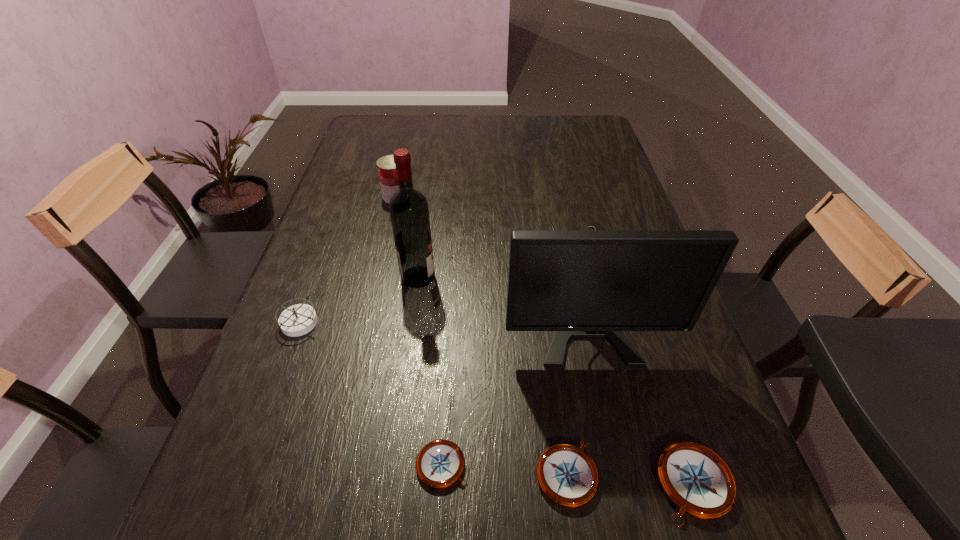
Locate an element on the screen. This screenshot has height=540, width=960. vacant space that satisfies the following two spatial constraints: 1. on the screen side of the computer monitor; 2. on the left side of the third shortest object is located at coordinates (619, 483).